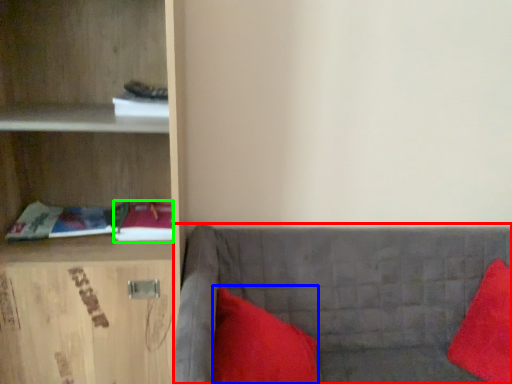
Question: Considering the real-world distances, which object is closest to studio couch (highlighted by a red box)? pillow (highlighted by a blue box) or book (highlighted by a green box).

Choices:
 (A) pillow
 (B) book

Answer: (A)